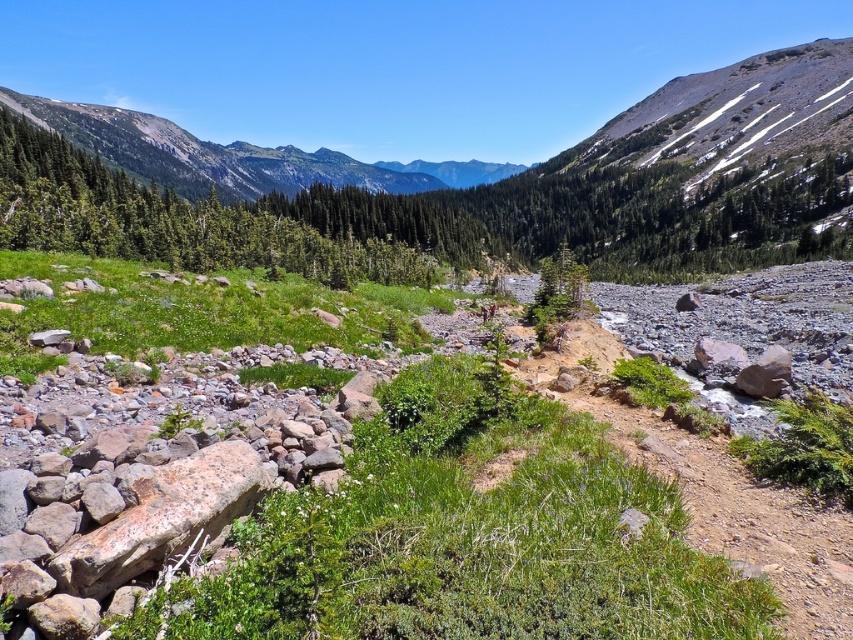
You are a hiker planning to take a photo of the green leafy tree at upper left and the green forested mountain at upper center. Based on their positions, which object should you focus on first to ensure both are in the frame?

The green leafy tree at upper left is positioned on the right side of the green forested mountain at upper center, so you should focus on the green forested mountain at upper center first to ensure both are in the frame.

Looking at this image, you are planning a hiking route and see the green leafy tree at upper left and the green forested mountain at upper center in the distance. Which object would appear closer to you in the image?

The green leafy tree at upper left appears closer to you because it is smaller than the green forested mountain at upper center, which is larger and likely farther away.